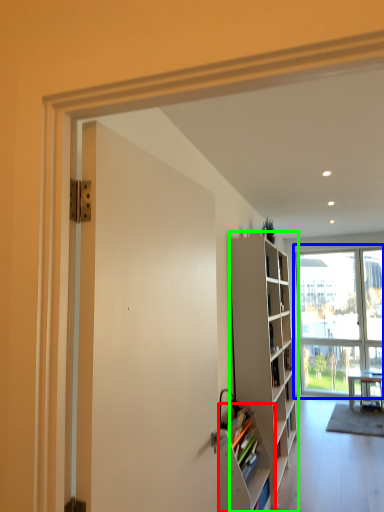
Question: Based on their relative distances, which object is nearer to shelf (highlighted by a red box)? Choose from window (highlighted by a blue box) and cabinetry (highlighted by a green box).

Choices:
 (A) window
 (B) cabinetry

Answer: (B)